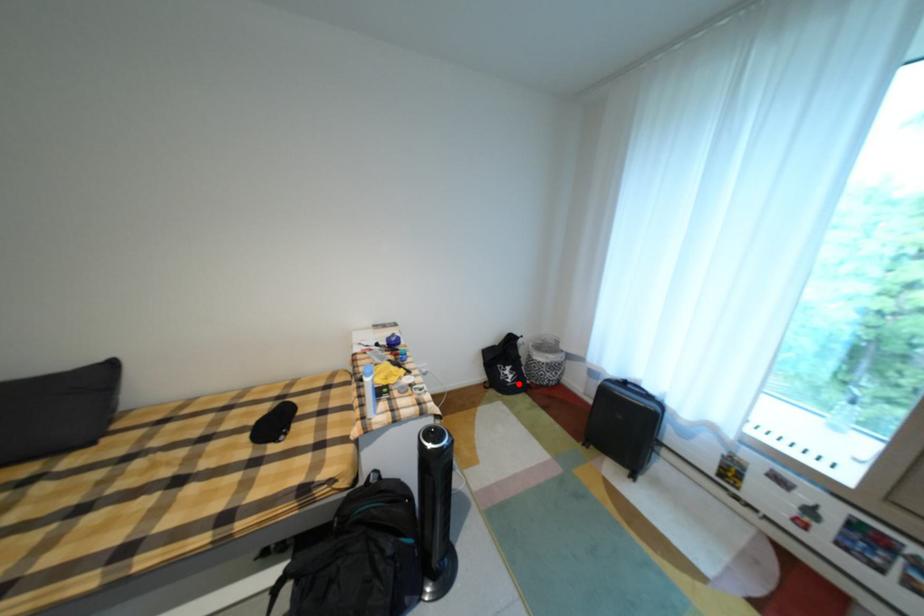
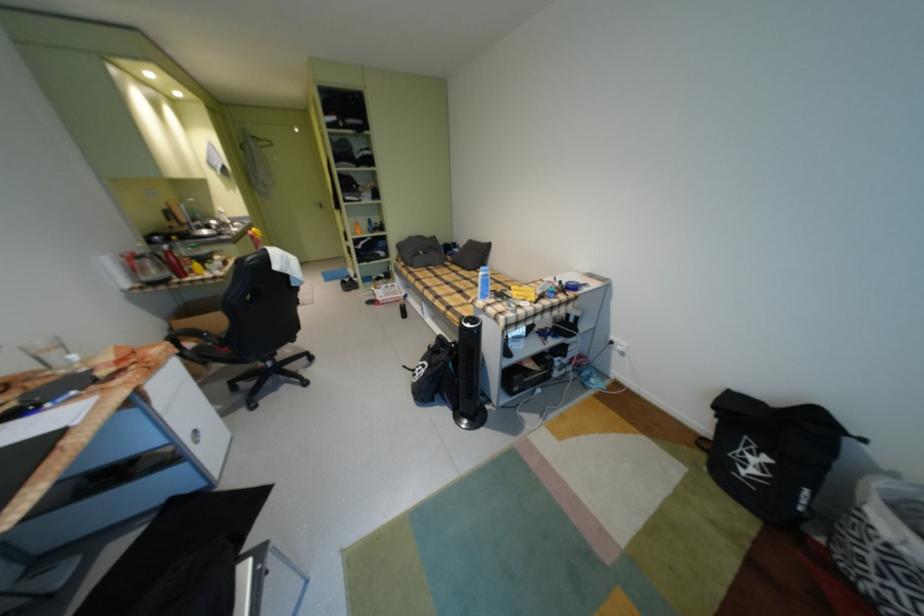
Question: I am providing you with two images of the same scene from different viewpoints. In image1, a red point is highlighted. Considering the same 3D point in image2, which of the following is correct?

Choices:
 (A) It is closer
 (B) It is farther

Answer: (A)